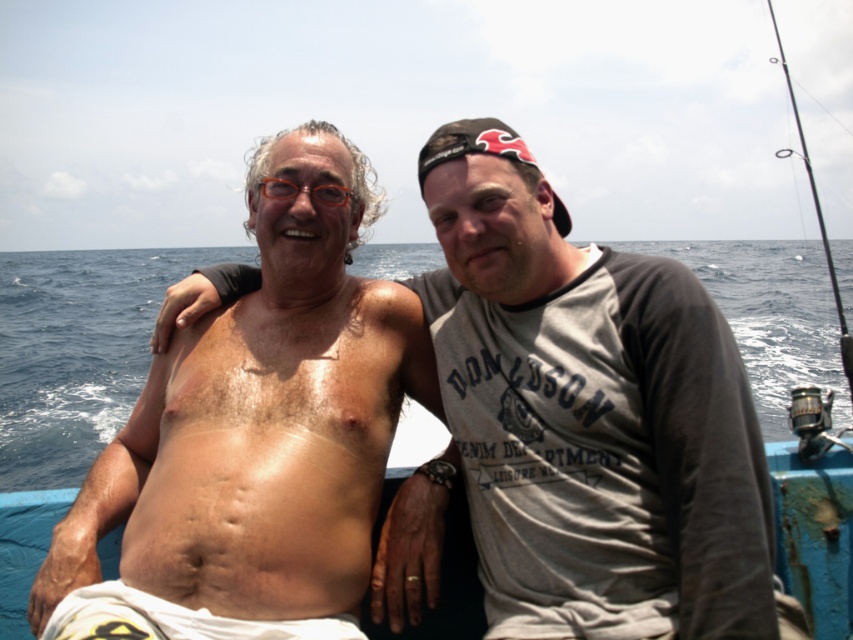
Find the location of a particular element. dry skin at center is located at coordinates (271, 445).

Does dry skin at center appear on the right side of blue water at center?

Yes, dry skin at center is to the right of blue water at center.

Consider the image. Who is more distant from viewer, (164, 424) or (107, 316)?

The point (107, 316) is more distant.

The height and width of the screenshot is (640, 853). In order to click on dry skin at center in this screenshot , I will do `click(271, 445)`.

Who is more distant from viewer, (708, 353) or (784, 422)?

Point (784, 422)

Measure the distance between skinny white man at center and camera.

5.63 feet

The height and width of the screenshot is (640, 853). I want to click on skinny white man at center, so click(x=595, y=428).

Between skinny white man at center and dry skin at center, which one is positioned higher?

skinny white man at center is higher up.

Is skinny white man at center taller than dry skin at center?

Correct, skinny white man at center is much taller as dry skin at center.

Is point (456, 396) in front of point (251, 508)?

No, (456, 396) is further to viewer.

You are a GUI agent. You are given a task and a screenshot of the screen. Output one action in this format:
    pyautogui.click(x=<x>, y=<y>)
    Task: Click on the skinny white man at center
    The width and height of the screenshot is (853, 640).
    Given the screenshot: What is the action you would take?
    595,428